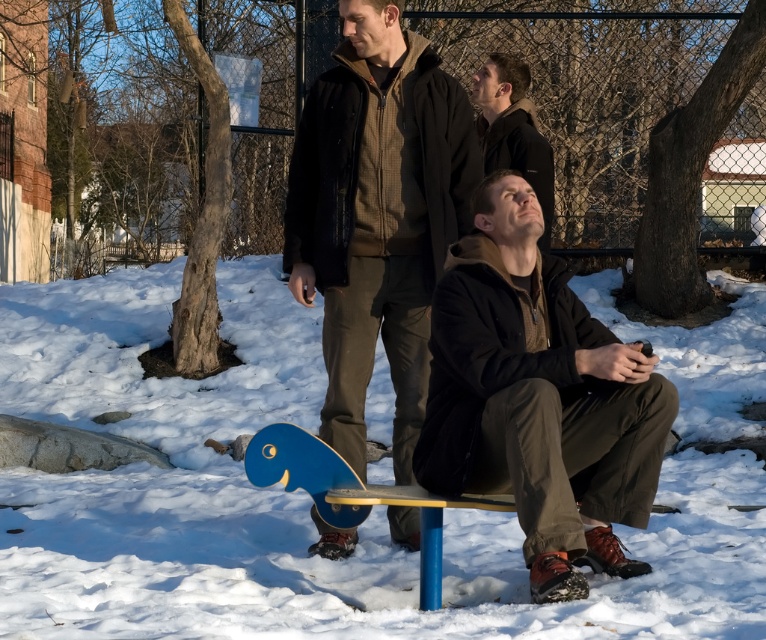
Question: Does dark brown jacket at center appear on the right side of dark brown leather jacket at center?

Choices:
 (A) no
 (B) yes

Answer: (A)

Question: Where is matte black jacket at center located in relation to blue plastic skateboard at lower center in the image?

Choices:
 (A) right
 (B) left

Answer: (A)

Question: Which of the following is the farthest from the observer?

Choices:
 (A) dark brown leather jacket at center
 (B) white fluffy snow at center
 (C) dark brown jacket at center
 (D) blue plastic skateboard at lower center

Answer: (A)

Question: Where is dark brown jacket at center located in relation to dark brown leather jacket at center in the image?

Choices:
 (A) below
 (B) above

Answer: (A)

Question: Which of the following is the closest to the observer?

Choices:
 (A) (498, 77)
 (B) (352, 435)
 (C) (588, 602)

Answer: (C)

Question: Which of the following is the closest to the observer?

Choices:
 (A) (175, 540)
 (B) (539, 198)
 (C) (283, 426)

Answer: (C)